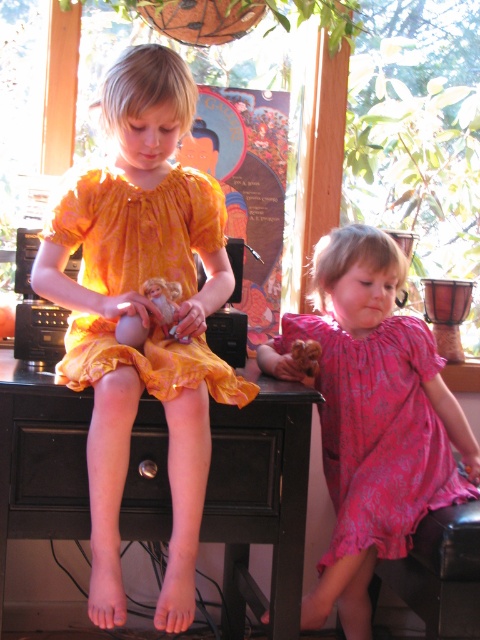
Is pink floral dress at lower right below orange printed dress at center?

Yes.

Who is positioned more to the left, pink floral dress at lower right or orange printed dress at center?

From the viewer's perspective, orange printed dress at center appears more on the left side.

Is point (384, 452) in front of point (240, 378)?

That is False.

You are a GUI agent. You are given a task and a screenshot of the screen. Output one action in this format:
    pyautogui.click(x=<x>, y=<y>)
    Task: Click on the pink floral dress at lower right
    The image size is (480, 640).
    Given the screenshot: What is the action you would take?
    pyautogui.click(x=379, y=433)

Identify the location of black wood table at center. (264, 484).

Is black wood table at center shorter than pink floral dress at lower right?

Yes, black wood table at center is shorter than pink floral dress at lower right.

The image size is (480, 640). Describe the element at coordinates (264, 484) in the screenshot. I see `black wood table at center` at that location.

Locate an element on the screen. black wood table at center is located at coordinates (264, 484).

Does point (100, 186) come in front of point (162, 314)?

No, it is behind (162, 314).

Between point (154, 381) and point (149, 284), which one is positioned in front?

Point (154, 381)

Does point (163, 262) come in front of point (172, 310)?

No, it is not.

Identify the location of orange satin dress at center. (143, 316).